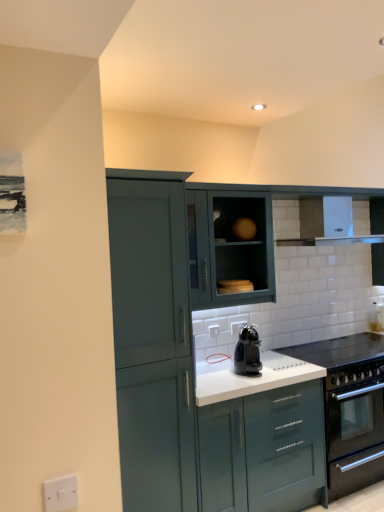
Locate an element on the screen. Image resolution: width=384 pixels, height=512 pixels. black plastic coffee machine at center is located at coordinates (247, 352).

What do you see at coordinates (230, 248) in the screenshot? Image resolution: width=384 pixels, height=512 pixels. I see `matte dark green cabinet at upper center, the 3th cabinetry positioned from the front` at bounding box center [230, 248].

How much space does matte teal cabinet at left, arranged as the fourth cabinetry when viewed from the back, occupy horizontally?

It is 25.14 inches.

Identify the location of white plastic electric outlet at lower left. (61, 493).

The width and height of the screenshot is (384, 512). Describe the element at coordinates (61, 493) in the screenshot. I see `white plastic electric outlet at lower left` at that location.

Describe the element at coordinates (264, 450) in the screenshot. I see `matte teal cabinet at center, arranged as the 2th cabinetry when viewed from the front` at that location.

Identify the location of black plastic coffee machine at center. Image resolution: width=384 pixels, height=512 pixels. (247, 352).

Which of these two, black plastic coffee machine at center or matte teal cabinet at center, which is the 3th cabinetry in back-to-front order, is wider?

matte teal cabinet at center, which is the 3th cabinetry in back-to-front order.

Is black plastic coffee machine at center oriented away from matte teal cabinet at center, which is the 3th cabinetry in back-to-front order?

No.

In the scene shown: How distant is black plastic coffee machine at center from matte teal cabinet at center, arranged as the 2th cabinetry when viewed from the front?

black plastic coffee machine at center and matte teal cabinet at center, arranged as the 2th cabinetry when viewed from the front, are 47.81 centimeters apart from each other.

What's the angular difference between black plastic coffee machine at center and matte teal cabinet at center, arranged as the 2th cabinetry when viewed from the front,'s facing directions?

There is a 4.86-degree angle between the facing directions of black plastic coffee machine at center and matte teal cabinet at center, arranged as the 2th cabinetry when viewed from the front.

Does matte dark green cabinet at upper center, the 2th cabinetry from the back, have a larger size compared to black plastic coffee machine at center?

Correct, matte dark green cabinet at upper center, the 2th cabinetry from the back, is larger in size than black plastic coffee machine at center.

Which object is positioned more to the left, matte dark green cabinet at upper center, the 3th cabinetry positioned from the front, or black plastic coffee machine at center?

matte dark green cabinet at upper center, the 3th cabinetry positioned from the front.

Is matte dark green cabinet at upper center, the 2th cabinetry from the back, turned away from black plastic coffee machine at center?

matte dark green cabinet at upper center, the 2th cabinetry from the back, does not have its back to black plastic coffee machine at center.

From a real-world perspective, is matte dark green cabinet at upper center, the 3th cabinetry positioned from the front, positioned above or below black plastic coffee machine at center?

In terms of real-world spatial position, matte dark green cabinet at upper center, the 3th cabinetry positioned from the front, is above black plastic coffee machine at center.

Can you confirm if black plastic coffee machine at center is thinner than matte green cabinet at upper center, arranged as the 1th cabinetry when viewed from the back?

In fact, black plastic coffee machine at center might be wider than matte green cabinet at upper center, arranged as the 1th cabinetry when viewed from the back.

Which of these two, black plastic coffee machine at center or matte green cabinet at upper center, arranged as the 1th cabinetry when viewed from the back, is smaller?

black plastic coffee machine at center is smaller.

Which is behind, black plastic coffee machine at center or matte green cabinet at upper center, arranged as the 1th cabinetry when viewed from the back?

matte green cabinet at upper center, arranged as the 1th cabinetry when viewed from the back.

Could you tell me if black plastic coffee machine at center is turned towards matte green cabinet at upper center, marked as the fourth cabinetry in a front-to-back arrangement?

No.

Between point (68, 507) and point (205, 297), which one is positioned in front?

The point (68, 507) is more forward.

From a real-world perspective, is white plastic electric outlet at lower left positioned above or below matte dark green cabinet at upper center, the 2th cabinetry from the back?

white plastic electric outlet at lower left is situated lower than matte dark green cabinet at upper center, the 2th cabinetry from the back, in the real world.

Can you see white plastic electric outlet at lower left touching matte dark green cabinet at upper center, the 3th cabinetry positioned from the front?

No, white plastic electric outlet at lower left is not in contact with matte dark green cabinet at upper center, the 3th cabinetry positioned from the front.

Is matte dark green cabinet at upper center, the 2th cabinetry from the back, situated inside matte green cabinet at upper center, marked as the fourth cabinetry in a front-to-back arrangement, or outside?

matte dark green cabinet at upper center, the 2th cabinetry from the back, is located beyond the bounds of matte green cabinet at upper center, marked as the fourth cabinetry in a front-to-back arrangement.

Could you tell me if matte dark green cabinet at upper center, the 2th cabinetry from the back, is turned towards matte green cabinet at upper center, arranged as the 1th cabinetry when viewed from the back?

No.

Is point (251, 265) more distant than point (206, 190)?

That is True.

The width and height of the screenshot is (384, 512). I want to click on cabinetry that is the 1st object directly below the matte dark green cabinet at upper center, the 2th cabinetry from the back (from a real-world perspective), so point(237,239).

Considering the relative positions of matte teal cabinet at center, which is the 3th cabinetry in back-to-front order, and matte dark green cabinet at upper center, the 3th cabinetry positioned from the front, in the image provided, is matte teal cabinet at center, which is the 3th cabinetry in back-to-front order, behind matte dark green cabinet at upper center, the 3th cabinetry positioned from the front,?

That is False.

Looking at the image, does matte teal cabinet at center, arranged as the 2th cabinetry when viewed from the front, seem bigger or smaller compared to matte dark green cabinet at upper center, the 3th cabinetry positioned from the front?

Clearly, matte teal cabinet at center, arranged as the 2th cabinetry when viewed from the front, is larger in size than matte dark green cabinet at upper center, the 3th cabinetry positioned from the front.

From their relative heights in the image, would you say matte teal cabinet at center, which is the 3th cabinetry in back-to-front order, is taller or shorter than matte dark green cabinet at upper center, the 2th cabinetry from the back?

Clearly, matte teal cabinet at center, which is the 3th cabinetry in back-to-front order, is taller compared to matte dark green cabinet at upper center, the 2th cabinetry from the back.

Based on the photo, can we say matte teal cabinet at left, the first cabinetry from the front, lies outside matte dark green cabinet at upper center, the 2th cabinetry from the back?

Yes, matte teal cabinet at left, the first cabinetry from the front, is located beyond the bounds of matte dark green cabinet at upper center, the 2th cabinetry from the back.

From a real-world perspective, is matte teal cabinet at left, the first cabinetry from the front, physically below matte dark green cabinet at upper center, the 2th cabinetry from the back?

Yes, from a real-world perspective, matte teal cabinet at left, the first cabinetry from the front, is under matte dark green cabinet at upper center, the 2th cabinetry from the back.

Considering the sizes of matte teal cabinet at left, the first cabinetry from the front, and matte dark green cabinet at upper center, the 2th cabinetry from the back, in the image, is matte teal cabinet at left, the first cabinetry from the front, taller or shorter than matte dark green cabinet at upper center, the 2th cabinetry from the back,?

Clearly, matte teal cabinet at left, the first cabinetry from the front, is taller compared to matte dark green cabinet at upper center, the 2th cabinetry from the back.

Is matte teal cabinet at left, the first cabinetry from the front, closer to the viewer compared to matte dark green cabinet at upper center, the 3th cabinetry positioned from the front?

Yes, matte teal cabinet at left, the first cabinetry from the front, is closer to the viewer.

You are a GUI agent. You are given a task and a screenshot of the screen. Output one action in this format:
    pyautogui.click(x=<x>, y=<y>)
    Task: Click on the cabinetry that appears below the black plastic coffee machine at center (from a real-world perspective)
    Image resolution: width=384 pixels, height=512 pixels.
    Given the screenshot: What is the action you would take?
    pyautogui.click(x=264, y=450)

This screenshot has height=512, width=384. In order to click on kitchen appliance in front of the matte dark green cabinet at upper center, the 3th cabinetry positioned from the front in this screenshot , I will do `click(247, 352)`.

Which object lies nearer to the anchor point matte dark green cabinet at upper center, the 3th cabinetry positioned from the front, black plastic coffee machine at center or white glossy exhaust hood at upper right?

Among the two, black plastic coffee machine at center is located nearer to matte dark green cabinet at upper center, the 3th cabinetry positioned from the front.

From the image, which object appears to be nearer to black plastic coffee machine at center, matte dark green cabinet at upper center, the 3th cabinetry positioned from the front, or matte teal cabinet at left, the first cabinetry from the front?

Based on the image, matte dark green cabinet at upper center, the 3th cabinetry positioned from the front, appears to be nearer to black plastic coffee machine at center.

In the scene shown: Which object lies further to the anchor point white glossy countertop at center, black plastic coffee machine at center or white plastic electric outlet at lower left?

Among the two, white plastic electric outlet at lower left is located further to white glossy countertop at center.

Which object lies nearer to the anchor point matte green cabinet at upper center, marked as the fourth cabinetry in a front-to-back arrangement, matte teal cabinet at left, arranged as the fourth cabinetry when viewed from the back, or matte teal cabinet at center, arranged as the 2th cabinetry when viewed from the front?

matte teal cabinet at left, arranged as the fourth cabinetry when viewed from the back, is positioned closer to the anchor matte green cabinet at upper center, marked as the fourth cabinetry in a front-to-back arrangement.

Which object lies further to the anchor point black plastic coffee machine at center, white glossy exhaust hood at upper right or white glossy countertop at center?

white glossy exhaust hood at upper right.

Estimate the real-world distances between objects in this image. Which object is further from black plastic coffee machine at center, white glossy countertop at center or matte green cabinet at upper center, marked as the fourth cabinetry in a front-to-back arrangement?

Based on the image, white glossy countertop at center appears to be further to black plastic coffee machine at center.

From the image, which object appears to be nearer to white glossy countertop at center, matte green cabinet at upper center, marked as the fourth cabinetry in a front-to-back arrangement, or matte teal cabinet at center, arranged as the 2th cabinetry when viewed from the front?

matte teal cabinet at center, arranged as the 2th cabinetry when viewed from the front.

Looking at the image, which one is located closer to white glossy countertop at center, white glossy exhaust hood at upper right or matte teal cabinet at left, the first cabinetry from the front?

Among the two, white glossy exhaust hood at upper right is located nearer to white glossy countertop at center.

The width and height of the screenshot is (384, 512). In order to click on kitchen appliance between matte dark green cabinet at upper center, the 3th cabinetry positioned from the front, and white glossy exhaust hood at upper right in this screenshot , I will do `click(247, 352)`.

I want to click on countertop between matte green cabinet at upper center, arranged as the 1th cabinetry when viewed from the back, and matte teal cabinet at center, arranged as the 2th cabinetry when viewed from the front, in the vertical direction, so click(339, 351).

The height and width of the screenshot is (512, 384). Identify the location of kitchen appliance between matte green cabinet at upper center, marked as the fourth cabinetry in a front-to-back arrangement, and matte teal cabinet at center, arranged as the 2th cabinetry when viewed from the front, in the up-down direction. (247, 352).

Identify the location of countertop between white glossy exhaust hood at upper right and matte teal cabinet at center, arranged as the 2th cabinetry when viewed from the front, from top to bottom. (339, 351).